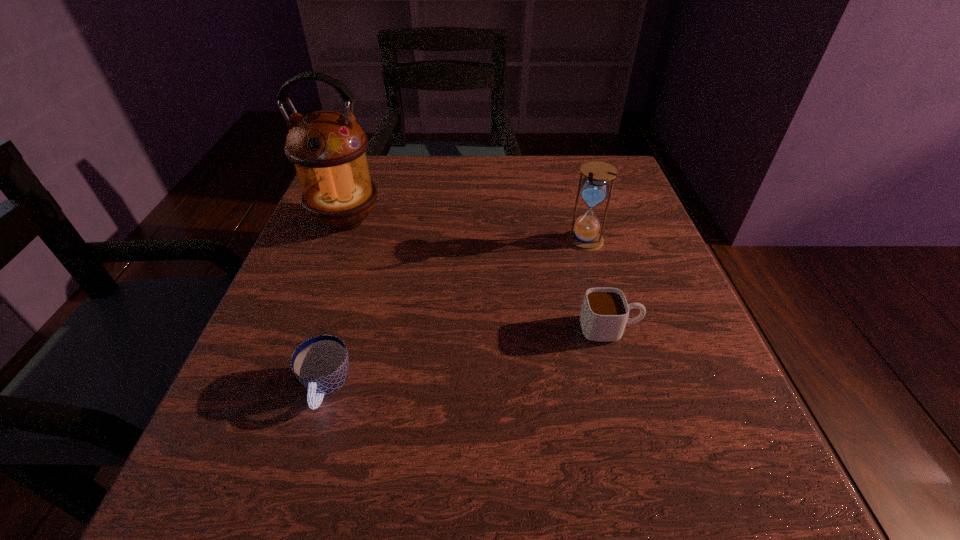
Image resolution: width=960 pixels, height=540 pixels. I want to click on object that is at the far edge, so click(328, 148).

Where is `oil lamp present at the left edge`? Image resolution: width=960 pixels, height=540 pixels. oil lamp present at the left edge is located at coordinates (328, 148).

The height and width of the screenshot is (540, 960). What are the coordinates of `cup positioned at the left edge` in the screenshot? It's located at (321, 363).

I want to click on hourglass that is at the right edge, so click(585, 236).

What are the coordinates of `cup present at the right edge` in the screenshot? It's located at pyautogui.click(x=604, y=313).

Locate an element on the screen. Image resolution: width=960 pixels, height=540 pixels. object that is at the far left corner is located at coordinates (328, 148).

In the image, there is a desktop. At what (x,y) coordinates should I click in order to perform the action: click on blank space at the far edge. Please return your answer as a coordinate pair (x, y). Looking at the image, I should click on (420, 193).

The image size is (960, 540). In the image, there is a desktop. In order to click on free space at the left edge in this screenshot , I will do `click(336, 298)`.

In order to click on vacant space at the right edge of the desktop in this screenshot , I will do `click(666, 276)`.

The width and height of the screenshot is (960, 540). In order to click on blank space at the far left corner in this screenshot , I will do `click(383, 179)`.